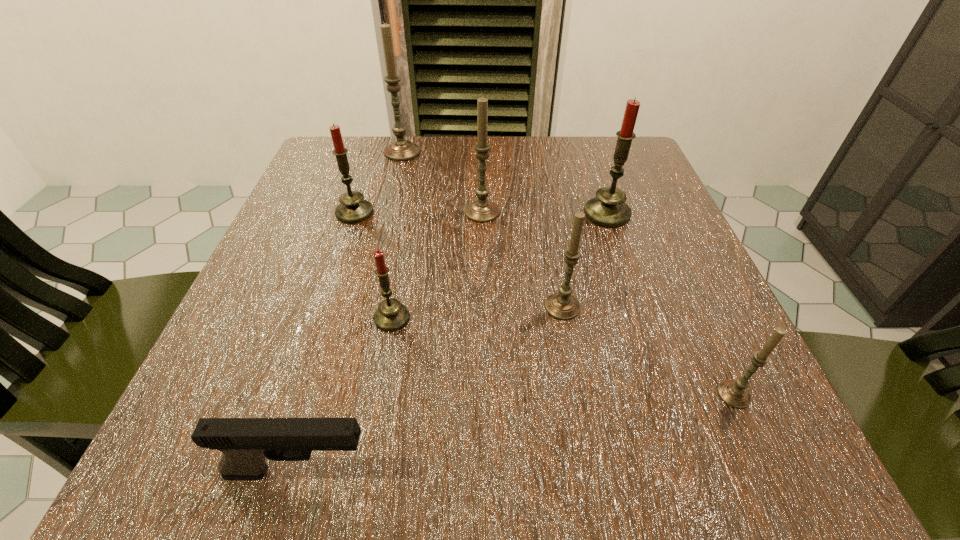
Locate an element on the screen. The image size is (960, 540). free space at the left edge is located at coordinates point(336,281).

The width and height of the screenshot is (960, 540). In the image, there is a desktop. Identify the location of vacant space at the right edge. (742, 358).

Where is `free space at the far left corner of the desktop`? This screenshot has height=540, width=960. free space at the far left corner of the desktop is located at coordinates (307, 190).

Locate an element on the screen. free space at the near left corner of the desktop is located at coordinates (285, 411).

You are a GUI agent. You are given a task and a screenshot of the screen. Output one action in this format:
    pyautogui.click(x=<x>, y=<y>)
    Task: Click on the free spot at the far right corner of the desktop
    Image resolution: width=960 pixels, height=540 pixels.
    Given the screenshot: What is the action you would take?
    pyautogui.click(x=592, y=139)

The width and height of the screenshot is (960, 540). In the image, there is a desktop. Find the location of `vacant space at the near right corner`. vacant space at the near right corner is located at coordinates (695, 416).

The image size is (960, 540). Identify the location of free space that is in between the sixth object from left to right and the third smallest gray candle. (522, 259).

What are the coordinates of `free spot between the sixth candle from left to right and the rightmost object` in the screenshot? It's located at (670, 304).

At what (x,y) coordinates should I click in order to perform the action: click on free space between the leftmost red candle and the smallest red candle. Please return your answer as a coordinate pair (x, y). Looking at the image, I should click on (373, 265).

I want to click on free space between the third nearest gray candle and the smallest red candle, so click(437, 265).